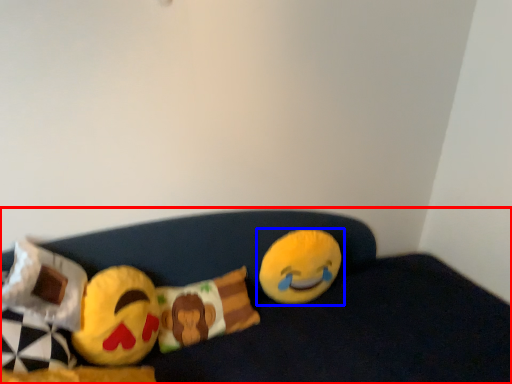
Question: Which point is further to the camera, furniture (highlighted by a red box) or toy (highlighted by a blue box)?

Choices:
 (A) furniture
 (B) toy

Answer: (B)